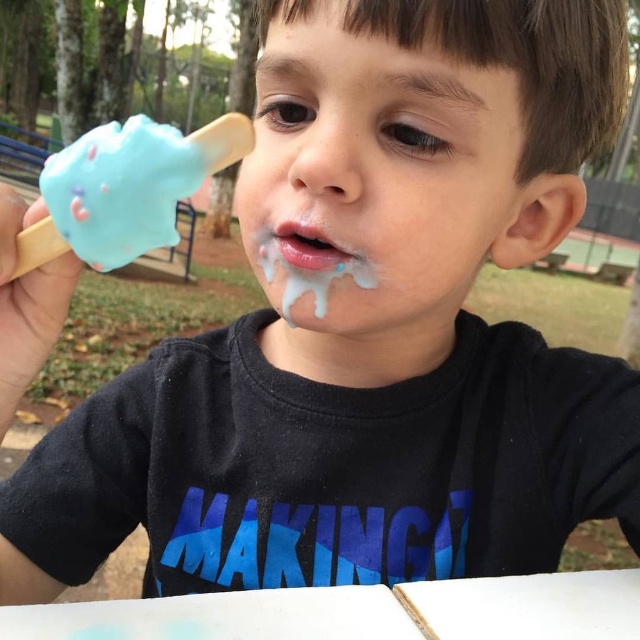
Question: Which is nearer to the blue matte ice cream cone at left?

Choices:
 (A) blue creamy frosting at mouth
 (B) matte blue ice cream at center
 (C) white matte lips at center

Answer: (C)

Question: Which point appears farthest from the camera in this image?

Choices:
 (A) (314, 6)
 (B) (141, 189)
 (C) (301, 252)

Answer: (C)

Question: Is matte blue ice cream at center closer to the viewer compared to blue matte ice cream cone at left?

Choices:
 (A) no
 (B) yes

Answer: (A)

Question: Is blue creamy frosting at mouth closer to camera compared to white matte lips at center?

Choices:
 (A) no
 (B) yes

Answer: (A)

Question: Is blue matte ice cream cone at left thinner than blue creamy frosting at mouth?

Choices:
 (A) yes
 (B) no

Answer: (B)

Question: Among these points, which one is nearest to the camera?

Choices:
 (A) (298, 227)
 (B) (339, 141)

Answer: (B)